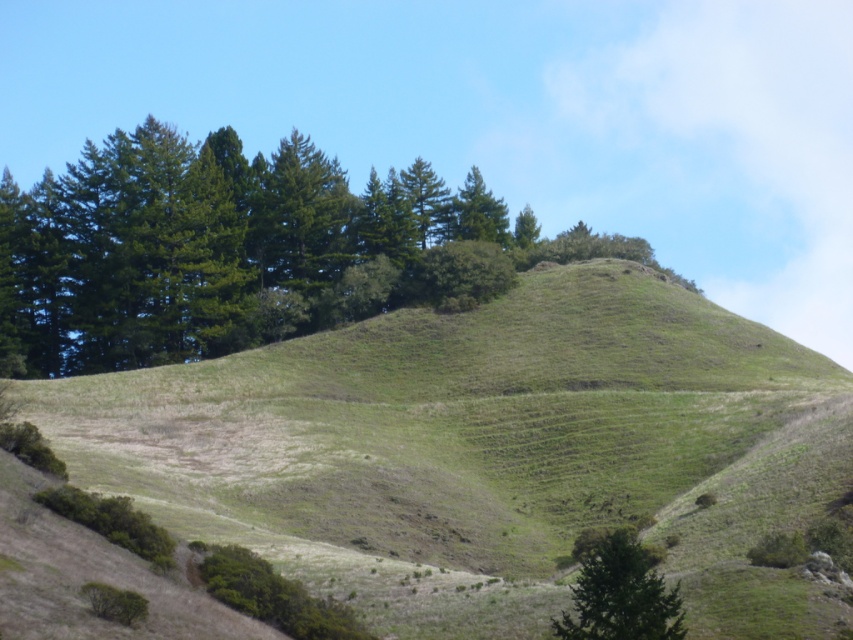
You are standing at the base of the hill and want to walk towards the green leafy trees at upper center. There is a green matte tree at lower right in your path. Which tree will you encounter first?

You will encounter the green leafy trees at upper center first because they are closer to you than the green matte tree at lower right, which is further away.

You are planning to set up a picnic area on the green grassy hillside at center. Considering the space available, will the area be narrower than the green leafy trees at upper center that are nearby?

The green grassy hillside at center has a width less than the green leafy trees at upper center, so yes, the picnic area will be narrower than the trees nearby.